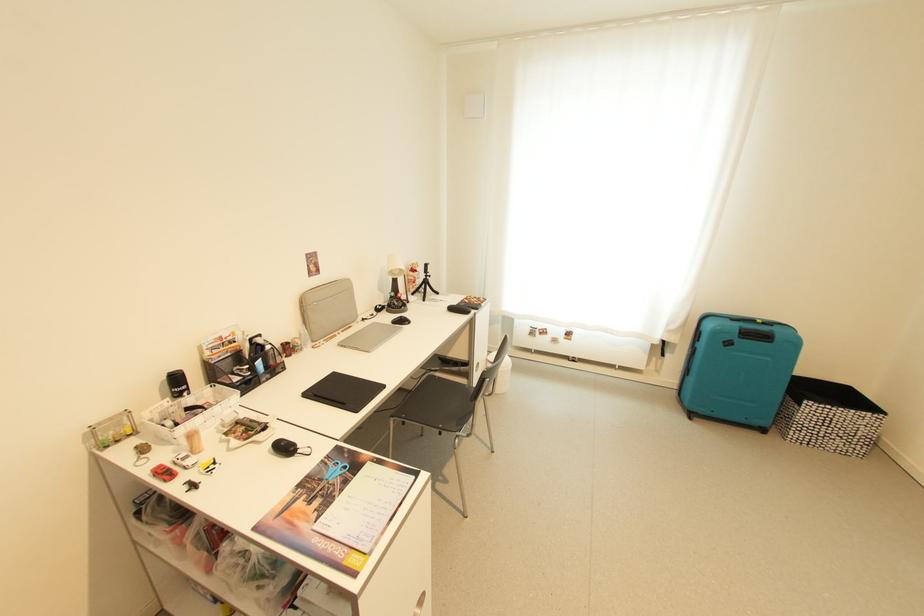
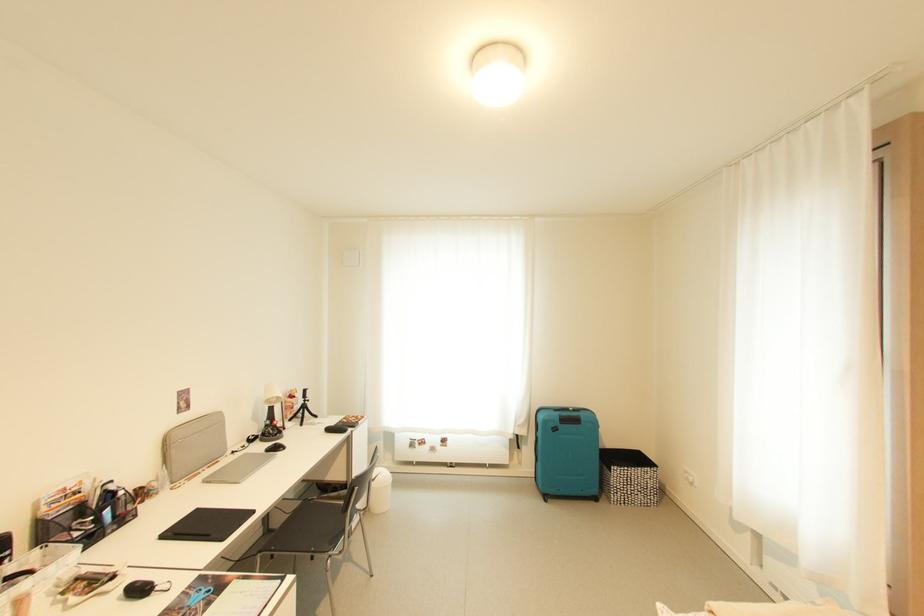
In the second image, find the point that corresponds to point 804,418 in the first image.

(617, 482)